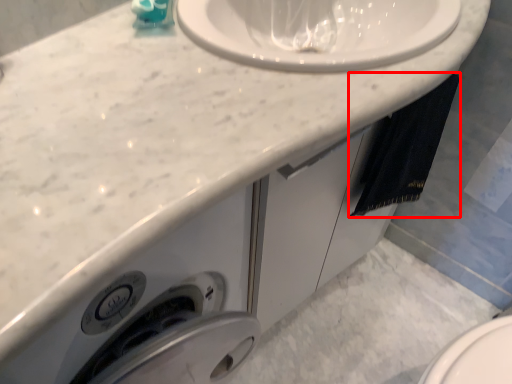
Question: From the image's perspective, where is bath towel (annotated by the red box) located relative to soap dispenser?

Choices:
 (A) above
 (B) below

Answer: (B)